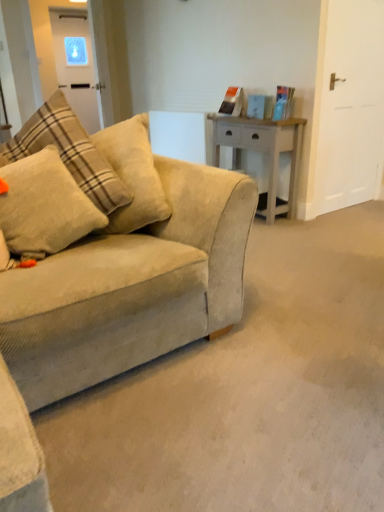
Identify the location of white wood side table at center. (263, 151).

Identify the location of fluffy beige pillow at left. (44, 206).

From a real-world perspective, is fluffy beige pillow at left over white matte door at right, which is the 1th glass door from right to left?

Incorrect, from a real-world perspective, fluffy beige pillow at left is lower than white matte door at right, which is the 1th glass door from right to left.

Can you confirm if fluffy beige pillow at left is wider than white matte door at right, which is the 1th glass door in front-to-back order?

Yes, fluffy beige pillow at left is wider than white matte door at right, which is the 1th glass door in front-to-back order.

Based on the photo, how different are the orientations of fluffy beige pillow at left and white matte door at right, marked as the second glass door in a back-to-front arrangement, in degrees?

fluffy beige pillow at left and white matte door at right, marked as the second glass door in a back-to-front arrangement, are facing 7.91 degrees away from each other.

Is fluffy beige pillow at left situated inside white matte door at right, marked as the second glass door in a back-to-front arrangement, or outside?

fluffy beige pillow at left cannot be found inside white matte door at right, marked as the second glass door in a back-to-front arrangement.

This screenshot has height=512, width=384. Find the location of `glass door in front of the transparent glass door at upper left, which appears as the second glass door when viewed from the front`. glass door in front of the transparent glass door at upper left, which appears as the second glass door when viewed from the front is located at coordinates (347, 108).

From the image's perspective, who appears lower, white matte door at right, marked as the second glass door in a back-to-front arrangement, or transparent glass door at upper left, which appears as the second glass door when viewed from the front?

white matte door at right, marked as the second glass door in a back-to-front arrangement.

Does white matte door at right, which is the 1th glass door in front-to-back order, lie behind transparent glass door at upper left, the second glass door in the right-to-left sequence?

No, white matte door at right, which is the 1th glass door in front-to-back order, is closer to the viewer.

How far apart are white matte door at right, which ranks as the second glass door in left-to-right order, and transparent glass door at upper left, the second glass door in the right-to-left sequence?

2.86 meters.

Would you say white wood side table at center contains transparent glass door at upper left, arranged as the 1th glass door when viewed from the back?

Definitely not — transparent glass door at upper left, arranged as the 1th glass door when viewed from the back, is not inside white wood side table at center.

Can you see white wood side table at center touching transparent glass door at upper left, which ranks as the 1th glass door in left-to-right order?

white wood side table at center and transparent glass door at upper left, which ranks as the 1th glass door in left-to-right order, are not in contact.

Who is bigger, white wood side table at center or transparent glass door at upper left, the second glass door in the right-to-left sequence?

white wood side table at center is bigger.

Where is `table below the transparent glass door at upper left, arranged as the 1th glass door when viewed from the back (from the image's perspective)`? table below the transparent glass door at upper left, arranged as the 1th glass door when viewed from the back (from the image's perspective) is located at coordinates (263, 151).

Considering the relative sizes of white matte door at right, which is the 1th glass door from right to left, and white wood side table at center in the image provided, is white matte door at right, which is the 1th glass door from right to left, shorter than white wood side table at center?

Incorrect, the height of white matte door at right, which is the 1th glass door from right to left, does not fall short of that of white wood side table at center.

Is white matte door at right, marked as the second glass door in a back-to-front arrangement, positioned beyond the bounds of white wood side table at center?

That's correct, white matte door at right, marked as the second glass door in a back-to-front arrangement, is outside of white wood side table at center.

At what (x,y) coordinates should I click in order to perform the action: click on the 1st glass door above when counting from the white wood side table at center (from the image's perspective). Please return your answer as a coordinate pair (x, y). Looking at the image, I should click on (347, 108).

Could you tell me if white matte door at right, marked as the second glass door in a back-to-front arrangement, is facing white wood side table at center?

No, white matte door at right, marked as the second glass door in a back-to-front arrangement, is not oriented towards white wood side table at center.

From a real-world perspective, between fluffy beige pillow at left and white wood side table at center, who is vertically higher?

From a 3D spatial view, fluffy beige pillow at left is above.

Is fluffy beige pillow at left turned away from white wood side table at center?

fluffy beige pillow at left does not have its back to white wood side table at center.

Between fluffy beige pillow at left and white wood side table at center, which one has larger width?

With larger width is white wood side table at center.

Does fluffy beige pillow at left contain white wood side table at center?

No, white wood side table at center is located outside of fluffy beige pillow at left.

Which of these two, fluffy beige pillow at left or transparent glass door at upper left, which ranks as the 1th glass door in left-to-right order, is wider?

With larger width is fluffy beige pillow at left.

Is fluffy beige pillow at left not close to transparent glass door at upper left, arranged as the 1th glass door when viewed from the back?

Absolutely, fluffy beige pillow at left is distant from transparent glass door at upper left, arranged as the 1th glass door when viewed from the back.

Is fluffy beige pillow at left smaller than transparent glass door at upper left, which ranks as the 1th glass door in left-to-right order?

Yes, fluffy beige pillow at left is smaller than transparent glass door at upper left, which ranks as the 1th glass door in left-to-right order.

From a real-world perspective, relative to white matte door at right, which is the 1th glass door in front-to-back order, is transparent glass door at upper left, which ranks as the 1th glass door in left-to-right order, vertically above or below?

transparent glass door at upper left, which ranks as the 1th glass door in left-to-right order, is above white matte door at right, which is the 1th glass door in front-to-back order.

Is transparent glass door at upper left, which ranks as the 1th glass door in left-to-right order, in contact with white matte door at right, which is the 1th glass door from right to left?

No, transparent glass door at upper left, which ranks as the 1th glass door in left-to-right order, is not making contact with white matte door at right, which is the 1th glass door from right to left.

Considering the relative sizes of transparent glass door at upper left, arranged as the 1th glass door when viewed from the back, and white matte door at right, which ranks as the second glass door in left-to-right order, in the image provided, is transparent glass door at upper left, arranged as the 1th glass door when viewed from the back, shorter than white matte door at right, which ranks as the second glass door in left-to-right order,?

Yes.

From the image's perspective, is transparent glass door at upper left, the second glass door in the right-to-left sequence, located above or below white matte door at right, which is the 1th glass door in front-to-back order?

Based on their image positions, transparent glass door at upper left, the second glass door in the right-to-left sequence, is located above white matte door at right, which is the 1th glass door in front-to-back order.

Where is `pillow on the left of the white matte door at right, which ranks as the second glass door in left-to-right order`? The width and height of the screenshot is (384, 512). pillow on the left of the white matte door at right, which ranks as the second glass door in left-to-right order is located at coordinates (44, 206).

At what (x,y) coordinates should I click in order to perform the action: click on glass door located in front of the transparent glass door at upper left, which appears as the second glass door when viewed from the front. Please return your answer as a coordinate pair (x, y). Looking at the image, I should click on (347, 108).

Looking at the image, which one is located further to white wood side table at center, fluffy beige pillow at left or transparent glass door at upper left, arranged as the 1th glass door when viewed from the back?

transparent glass door at upper left, arranged as the 1th glass door when viewed from the back, lies further to white wood side table at center than the other object.

From the image, which object appears to be nearer to white wood side table at center, white matte door at right, which ranks as the second glass door in left-to-right order, or transparent glass door at upper left, which ranks as the 1th glass door in left-to-right order?

Among the two, white matte door at right, which ranks as the second glass door in left-to-right order, is located nearer to white wood side table at center.

From the image, which object appears to be nearer to white wood side table at center, fluffy beige pillow at left or white matte door at right, marked as the second glass door in a back-to-front arrangement?

white matte door at right, marked as the second glass door in a back-to-front arrangement, is positioned closer to the anchor white wood side table at center.

Which object lies further to the anchor point transparent glass door at upper left, the second glass door in the right-to-left sequence, white matte door at right, which is the 1th glass door in front-to-back order, or white wood side table at center?

Based on the image, white matte door at right, which is the 1th glass door in front-to-back order, appears to be further to transparent glass door at upper left, the second glass door in the right-to-left sequence.

Considering their positions, is white matte door at right, which ranks as the second glass door in left-to-right order, positioned closer to transparent glass door at upper left, which appears as the second glass door when viewed from the front, than fluffy beige pillow at left?

Based on the image, white matte door at right, which ranks as the second glass door in left-to-right order, appears to be nearer to transparent glass door at upper left, which appears as the second glass door when viewed from the front.

Consider the image. Considering their positions, is transparent glass door at upper left, arranged as the 1th glass door when viewed from the back, positioned closer to white matte door at right, which ranks as the second glass door in left-to-right order, than fluffy beige pillow at left?

The object closer to white matte door at right, which ranks as the second glass door in left-to-right order, is fluffy beige pillow at left.

Estimate the real-world distances between objects in this image. Which object is further from fluffy beige pillow at left, transparent glass door at upper left, which ranks as the 1th glass door in left-to-right order, or white matte door at right, marked as the second glass door in a back-to-front arrangement?

transparent glass door at upper left, which ranks as the 1th glass door in left-to-right order.

Estimate the real-world distances between objects in this image. Which object is closer to white matte door at right, which ranks as the second glass door in left-to-right order, fluffy beige pillow at left or transparent glass door at upper left, which appears as the second glass door when viewed from the front?

Among the two, fluffy beige pillow at left is located nearer to white matte door at right, which ranks as the second glass door in left-to-right order.

I want to click on table positioned between fluffy beige pillow at left and transparent glass door at upper left, the second glass door in the right-to-left sequence, from near to far, so click(x=263, y=151).

Find the location of a particular element. table located between transparent glass door at upper left, arranged as the 1th glass door when viewed from the back, and white matte door at right, which is the 1th glass door from right to left, in the left-right direction is located at coordinates (263, 151).

Find the location of a particular element. glass door between fluffy beige pillow at left and transparent glass door at upper left, which ranks as the 1th glass door in left-to-right order, along the z-axis is located at coordinates (347, 108).

Where is `table situated between fluffy beige pillow at left and white matte door at right, marked as the second glass door in a back-to-front arrangement, from left to right`? The width and height of the screenshot is (384, 512). table situated between fluffy beige pillow at left and white matte door at right, marked as the second glass door in a back-to-front arrangement, from left to right is located at coordinates (263, 151).